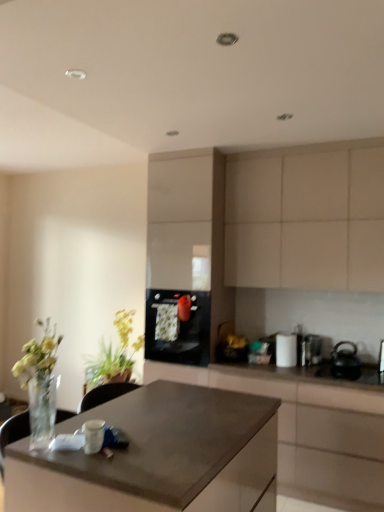
Where is `vacant area in front of black matte kettle at right, which is the 1th appliance from right to left`? The image size is (384, 512). vacant area in front of black matte kettle at right, which is the 1th appliance from right to left is located at coordinates coord(358,376).